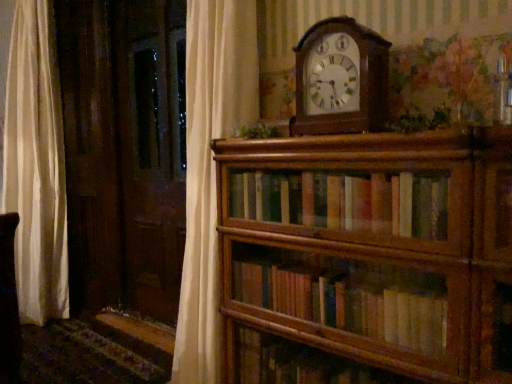
Question: From the image's perspective, is wooden wall clock at upper center above green leafy plant at upper center, placed as the 1th plant when sorted from left to right?

Choices:
 (A) no
 (B) yes

Answer: (B)

Question: Is wooden wall clock at upper center directly adjacent to green leafy plant at upper center, placed as the 1th plant when sorted from left to right?

Choices:
 (A) no
 (B) yes

Answer: (A)

Question: Is wooden wall clock at upper center not near green leafy plant at upper center, which is the 2th plant in right-to-left order?

Choices:
 (A) yes
 (B) no

Answer: (B)

Question: Can you confirm if wooden wall clock at upper center is bigger than green leafy plant at upper center, the second plant in the front-to-back sequence?

Choices:
 (A) yes
 (B) no

Answer: (A)

Question: From a real-world perspective, is wooden wall clock at upper center physically below green leafy plant at upper center, placed as the 1th plant when sorted from left to right?

Choices:
 (A) yes
 (B) no

Answer: (B)

Question: Based on their sizes in the image, would you say wooden wall clock at upper center is bigger or smaller than green leafy plant at upper center, the first plant viewed from the right?

Choices:
 (A) big
 (B) small

Answer: (A)

Question: Is wooden wall clock at upper center in front of or behind green leafy plant at upper center, the first plant viewed from the right, in the image?

Choices:
 (A) behind
 (B) front

Answer: (A)

Question: Is point (331, 127) closer or farther from the camera than point (418, 124)?

Choices:
 (A) farther
 (B) closer

Answer: (A)

Question: Considering the positions of wooden wall clock at upper center and green leafy plant at upper center, the first plant viewed from the right, in the image, is wooden wall clock at upper center wider or thinner than green leafy plant at upper center, the first plant viewed from the right,?

Choices:
 (A) wide
 (B) thin

Answer: (B)

Question: Choose the correct answer: Is wooden bookshelf at center inside green leafy plant at upper center, positioned as the 1th plant in front-to-back order, or outside it?

Choices:
 (A) outside
 (B) inside

Answer: (A)

Question: Is point (222, 225) closer or farther from the camera than point (437, 124)?

Choices:
 (A) farther
 (B) closer

Answer: (A)

Question: Considering the positions of wooden bookshelf at center and green leafy plant at upper center, the 2th plant positioned from the back, in the image, is wooden bookshelf at center taller or shorter than green leafy plant at upper center, the 2th plant positioned from the back,?

Choices:
 (A) short
 (B) tall

Answer: (B)

Question: From a real-world perspective, relative to green leafy plant at upper center, the 2th plant positioned from the back, is wooden bookshelf at center vertically above or below?

Choices:
 (A) below
 (B) above

Answer: (A)

Question: In the image, is green leafy plant at upper center, positioned as the 1th plant in front-to-back order, positioned in front of or behind green leafy plant at upper center, placed as the 1th plant when sorted from left to right?

Choices:
 (A) front
 (B) behind

Answer: (A)

Question: Looking at the image, does green leafy plant at upper center, the first plant viewed from the right, seem bigger or smaller compared to green leafy plant at upper center, placed as the first plant when sorted from back to front?

Choices:
 (A) big
 (B) small

Answer: (A)